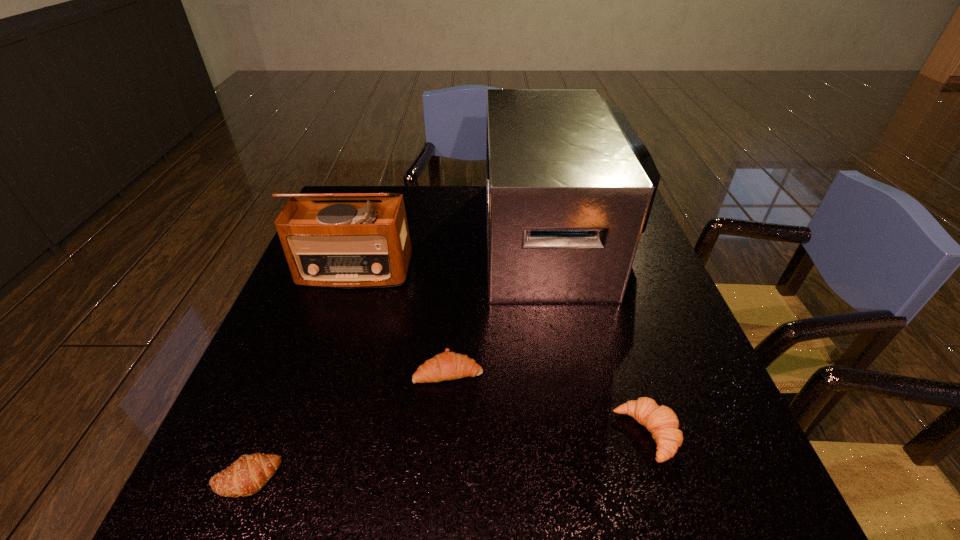
I want to click on unoccupied position between the fourth shortest object and the rightmost crescent roll, so click(x=500, y=352).

Identify the location of free space between the tallest object and the rightmost crescent roll. This screenshot has width=960, height=540. (602, 335).

The width and height of the screenshot is (960, 540). Find the location of `vacant region between the tallest object and the rightmost crescent roll`. vacant region between the tallest object and the rightmost crescent roll is located at coordinates (602, 335).

Locate an element on the screen. The width and height of the screenshot is (960, 540). empty location between the rightmost crescent roll and the tallest object is located at coordinates (602, 335).

Find the location of a particular element. This screenshot has width=960, height=540. the third closest object to the second crescent roll from left to right is located at coordinates (661, 421).

This screenshot has width=960, height=540. Find the location of `the closest object to the leftmost crescent roll`. the closest object to the leftmost crescent roll is located at coordinates (448, 365).

Identify which crescent roll is the closest to the fourth shortest object. Please provide its 2D coordinates. Your answer should be formatted as a tuple, i.e. [(x, y)], where the tuple contains the x and y coordinates of a point satisfying the conditions above.

[(448, 365)]

Identify the location of the closest crescent roll to the leftmost crescent roll. pyautogui.click(x=448, y=365).

I want to click on free space in the image that satisfies the following two spatial constraints: 1. on the front-facing side of the tallest object; 2. on the front panel of the second tallest object, so click(x=566, y=271).

Locate an element on the screen. The image size is (960, 540). vacant region that satisfies the following two spatial constraints: 1. on the front-facing side of the tallest object; 2. on the front panel of the radio receiver is located at coordinates (566, 271).